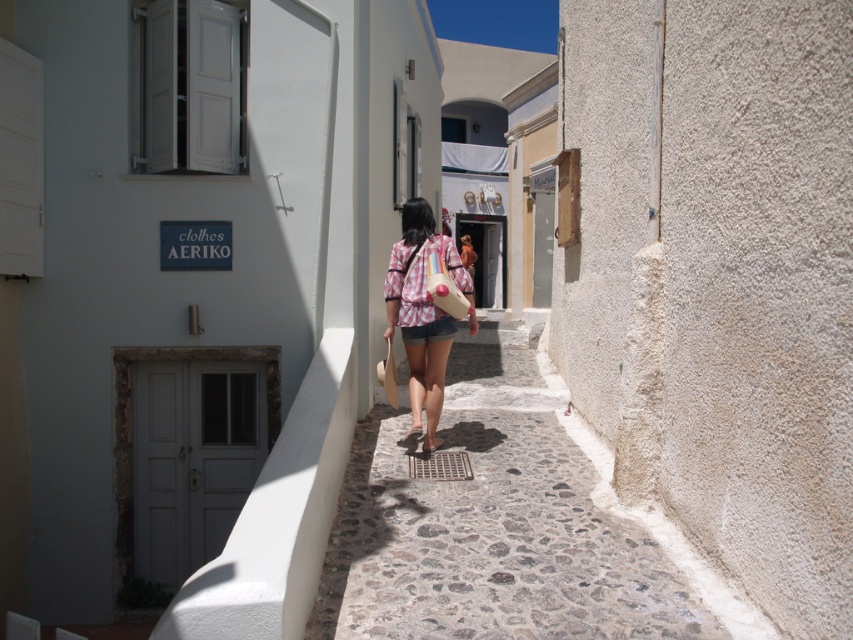
Question: Does pink plaid shirt at center have a smaller size compared to brown leather sandal at center?

Choices:
 (A) no
 (B) yes

Answer: (A)

Question: Which point is closer to the camera?

Choices:
 (A) brown leather sandal at center
 (B) pink plaid shirt at center
 (C) cobblestone alley at center

Answer: (C)

Question: Is cobblestone alley at center to the left of pink plaid shirt at center from the viewer's perspective?

Choices:
 (A) yes
 (B) no

Answer: (B)

Question: Considering the real-world distances, which object is farthest from the pink plaid shirt at center?

Choices:
 (A) cobblestone alley at center
 (B) brown leather sandal at center

Answer: (A)

Question: Does cobblestone alley at center have a greater width compared to pink plaid shirt at center?

Choices:
 (A) yes
 (B) no

Answer: (A)

Question: Which point appears closest to the camera in this image?

Choices:
 (A) (413, 429)
 (B) (389, 547)

Answer: (B)